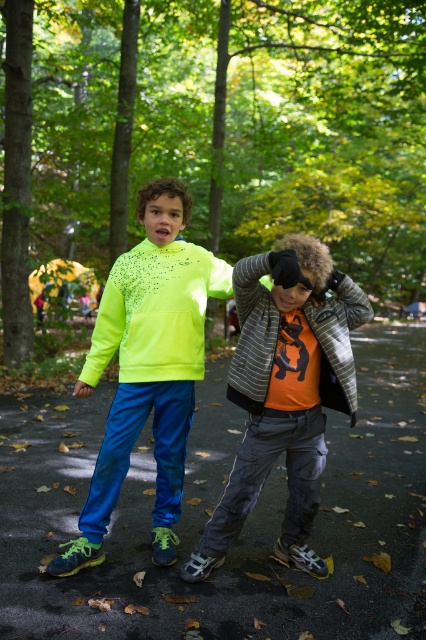
Is point (307, 512) positioned in front of point (161, 224)?

Yes, it is.

Which is behind, point (204, 548) or point (150, 317)?

Point (150, 317)

This screenshot has height=640, width=426. In order to click on orange matte shirt at center in this screenshot , I will do `click(284, 394)`.

Who is taller, neon matte sweatshirt at left or striped wool jacket at center?

striped wool jacket at center

The image size is (426, 640). Identify the location of neon matte sweatshirt at left. (155, 312).

In order to click on neon matte sweatshirt at left in this screenshot , I will do `click(155, 312)`.

Who is shorter, neon yellow hoodie at center or striped wool jacket at center?

Standing shorter between the two is striped wool jacket at center.

Does neon yellow hoodie at center have a greater height compared to striped wool jacket at center?

Indeed, neon yellow hoodie at center has a greater height compared to striped wool jacket at center.

At what (x,y) coordinates should I click in order to perform the action: click on neon yellow hoodie at center. Please return your answer as a coordinate pair (x, y). This screenshot has height=640, width=426. Looking at the image, I should click on (147, 365).

The width and height of the screenshot is (426, 640). What are the coordinates of `neon yellow hoodie at center` in the screenshot? It's located at (147, 365).